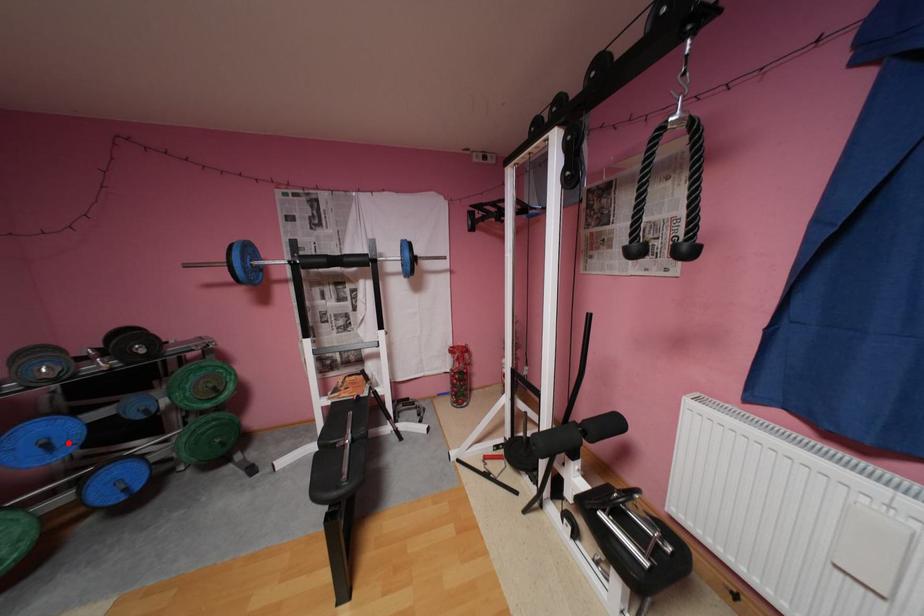
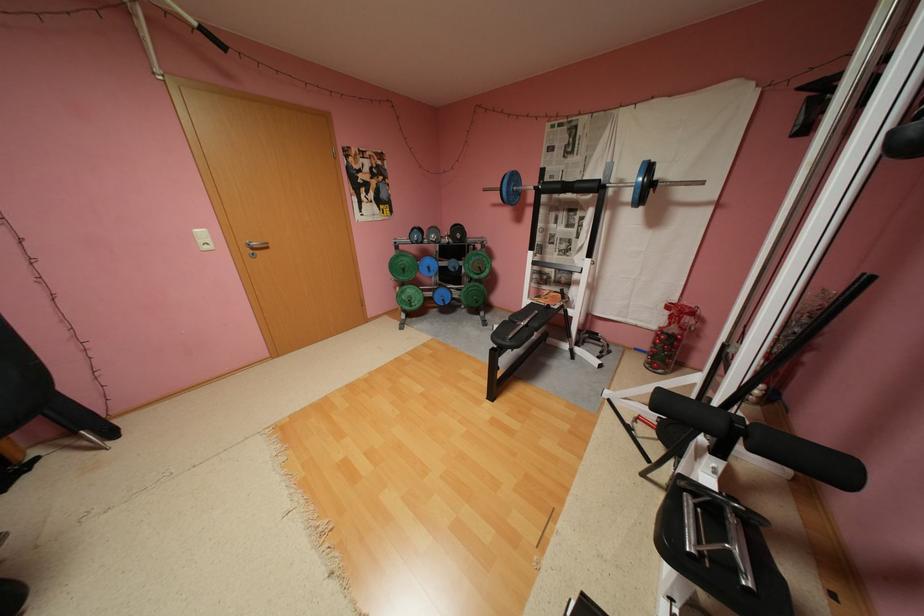
Question: I am providing you with two images of the same scene from different viewpoints. Image1 has a red point marked. In image2, the corresponding 3D location appears at what relative position? Reply with the corresponding letter.

Choices:
 (A) Closer
 (B) Farther

Answer: (A)